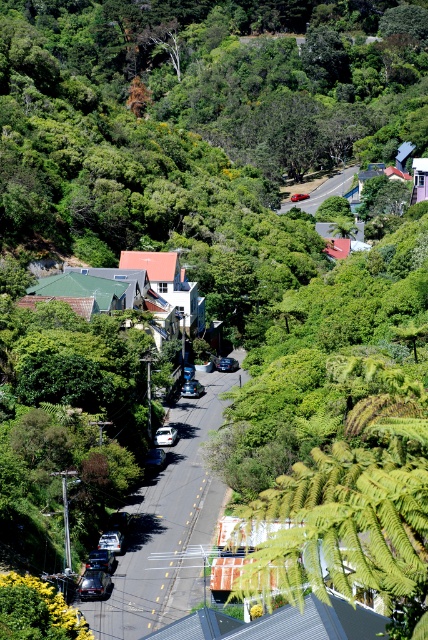
Question: Which object is farther from the camera taking this photo?

Choices:
 (A) metallic blue sedan at center
 (B) white matte car at center
 (C) shiny silver sedan at center

Answer: (C)

Question: Among these points, which one is farthest from the camera?

Choices:
 (A) (157, 428)
 (B) (181, 394)
 (C) (223, 362)

Answer: (C)

Question: Which of the following is the closest to the observer?

Choices:
 (A) coord(190,390)
 (B) coord(157,442)

Answer: (B)

Question: Does white matte car at center appear under metallic blue sedan at center?

Choices:
 (A) no
 (B) yes

Answer: (B)

Question: Is white matte car at center further to the viewer compared to metallic blue sedan at center?

Choices:
 (A) no
 (B) yes

Answer: (A)

Question: Is metallic blue sedan at center thinner than shiny silver sedan at center?

Choices:
 (A) no
 (B) yes

Answer: (B)